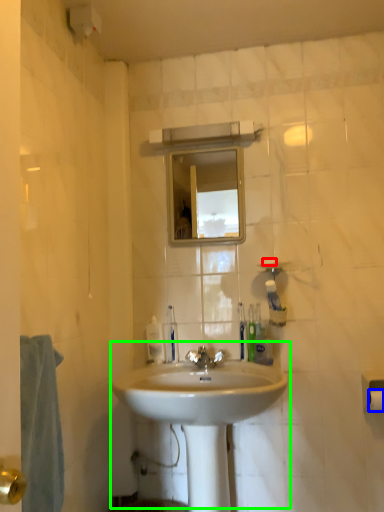
Question: Which object is the farthest from soap (highlighted by a red box)? Choose among these: toilet paper (highlighted by a blue box) or sink (highlighted by a green box).

Choices:
 (A) toilet paper
 (B) sink

Answer: (B)